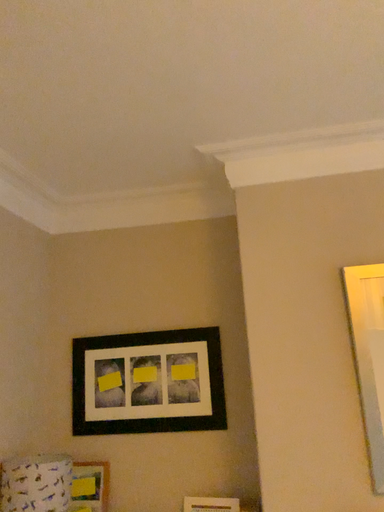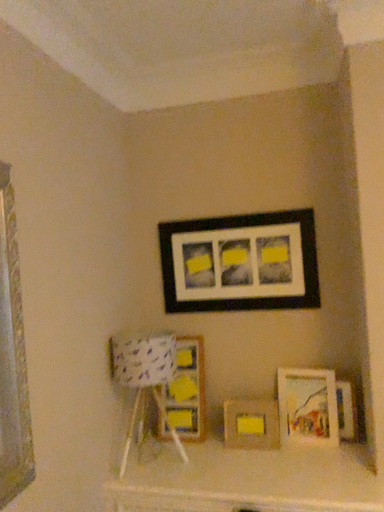
Question: How did the camera likely rotate when shooting the video?

Choices:
 (A) rotated upward
 (B) rotated downward

Answer: (B)